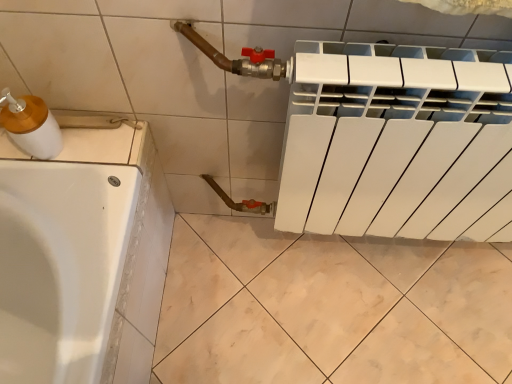
Question: Considering the positions of point (14, 120) and point (10, 117), is point (14, 120) closer or farther from the camera than point (10, 117)?

Choices:
 (A) farther
 (B) closer

Answer: (A)

Question: Considering the positions of matte white soap dispenser at left and white plastic sink at left in the image, is matte white soap dispenser at left taller or shorter than white plastic sink at left?

Choices:
 (A) tall
 (B) short

Answer: (A)

Question: Looking at their shapes, would you say matte white soap dispenser at left is wider or thinner than white plastic sink at left?

Choices:
 (A) thin
 (B) wide

Answer: (A)

Question: From a real-world perspective, relative to matte white soap dispenser at left, is white plastic sink at left vertically above or below?

Choices:
 (A) above
 (B) below

Answer: (B)

Question: Do you think white plastic sink at left is within matte white soap dispenser at left, or outside of it?

Choices:
 (A) outside
 (B) inside

Answer: (A)

Question: From the image's perspective, is white plastic sink at left located above or below matte white soap dispenser at left?

Choices:
 (A) below
 (B) above

Answer: (A)

Question: In the image, is white plastic sink at left on the left side or the right side of matte white soap dispenser at left?

Choices:
 (A) left
 (B) right

Answer: (A)